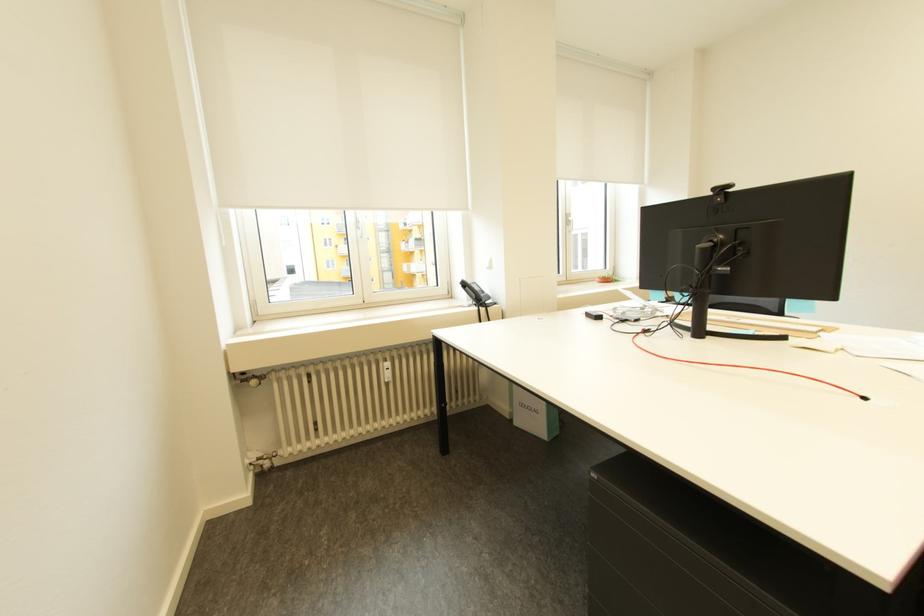
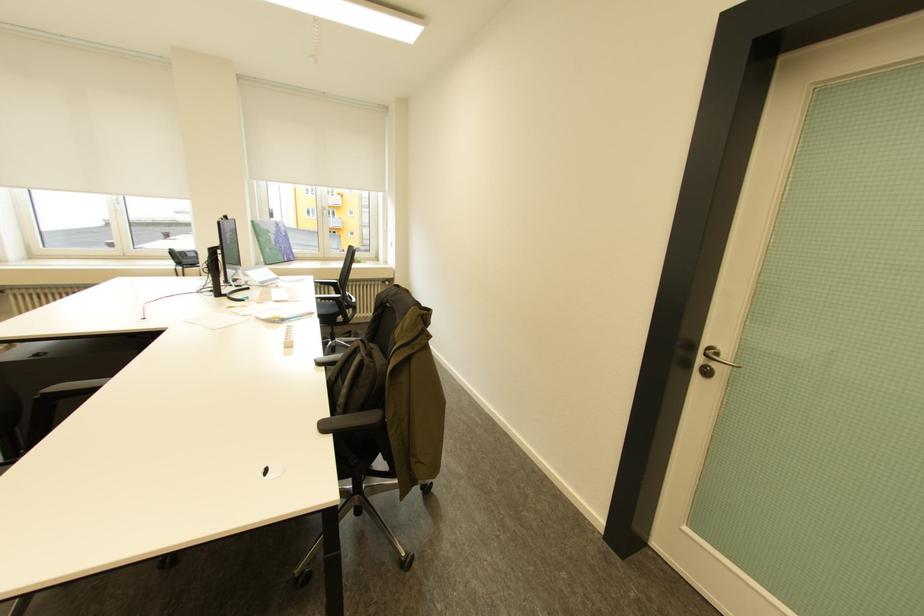
Which direction would the cameraman need to move to produce the second image?

The cameraman moved toward right, backward.